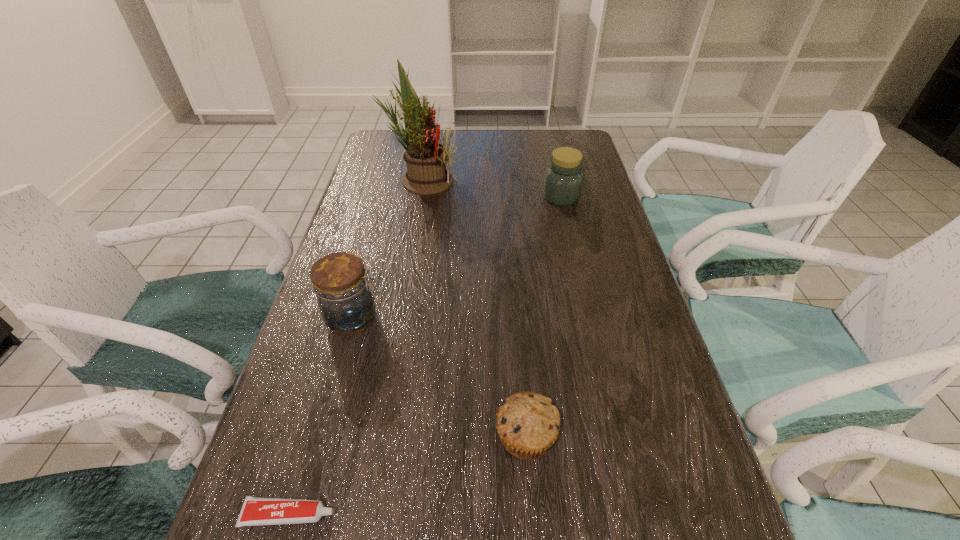
Where is `flower arrangement`? The image size is (960, 540). flower arrangement is located at coordinates click(x=426, y=159).

Locate an element on the screen. the third nearest object is located at coordinates (340, 282).

At what (x,y) coordinates should I click in order to perform the action: click on the nearer jar. Please return your answer as a coordinate pair (x, y). The image size is (960, 540). Looking at the image, I should click on (340, 282).

Find the location of a particular element. The image size is (960, 540). the farther jar is located at coordinates pyautogui.click(x=563, y=179).

Where is `the rightmost object`? the rightmost object is located at coordinates (563, 179).

Find the location of a particular element. This screenshot has height=540, width=960. muffin is located at coordinates (528, 423).

Locate an element on the screen. The image size is (960, 540). the second nearest object is located at coordinates (528, 423).

Find the location of a particular element. This screenshot has width=960, height=540. toothpaste is located at coordinates (255, 511).

You are a GUI agent. You are given a task and a screenshot of the screen. Output one action in this format:
    pyautogui.click(x=<x>, y=<y>)
    Task: Click on the shortest object
    This screenshot has height=540, width=960.
    Given the screenshot: What is the action you would take?
    pyautogui.click(x=255, y=511)

At what (x,y) coordinates should I click in order to perform the action: click on free point located 0.340m in front of the tallest object with the fan visible. Please return your answer as a coordinate pair (x, y). The image size is (960, 540). Looking at the image, I should click on (565, 180).